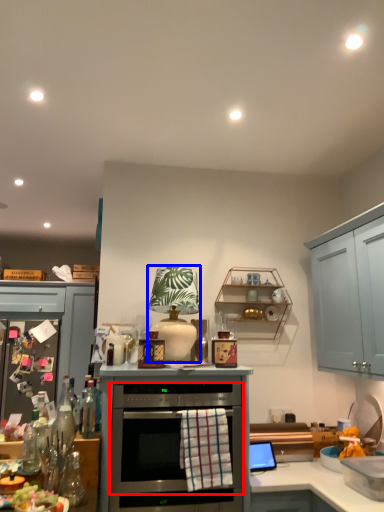
Question: Which object appears closest to the camera in this image, oven (highlighted by a red box) or appliance (highlighted by a blue box)?

Choices:
 (A) oven
 (B) appliance

Answer: (A)